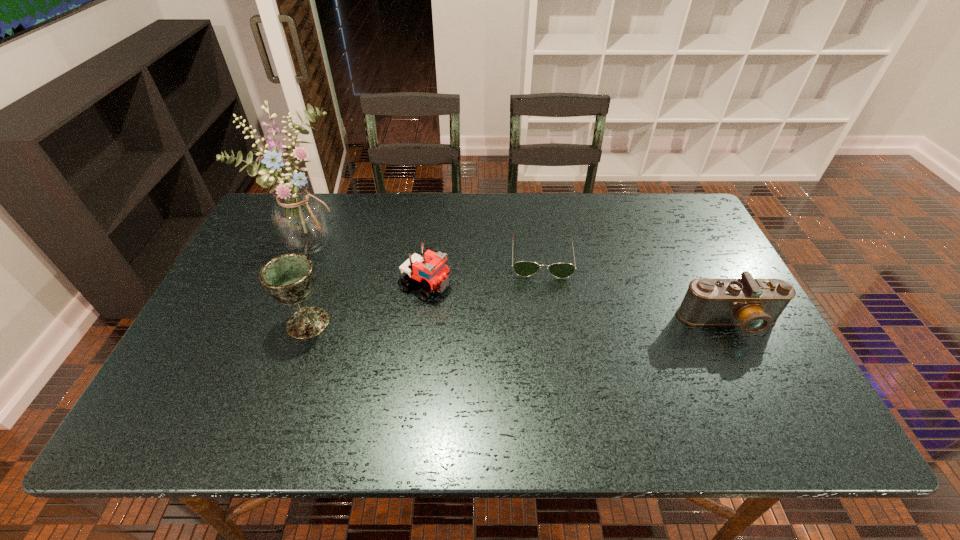
Where is `free space on the desktop that is between the chalice and the camera and is positioned on the front-facing side of the second object from right to left`? The height and width of the screenshot is (540, 960). free space on the desktop that is between the chalice and the camera and is positioned on the front-facing side of the second object from right to left is located at coordinates (544, 322).

The image size is (960, 540). Find the location of `free space on the desktop that is between the chalice and the rightmost object and is positioned on the front-facing side of the Lego`. free space on the desktop that is between the chalice and the rightmost object and is positioned on the front-facing side of the Lego is located at coordinates (504, 322).

Locate an element on the screen. vacant space on the desktop that is between the chalice and the rightmost object and is positioned on the front-facing side of the bouquet is located at coordinates (463, 322).